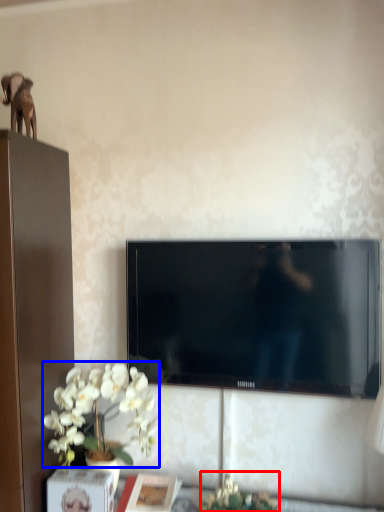
Question: Among these objects, which one is nearest to the camera, plant (highlighted by a red box) or flower (highlighted by a blue box)?

Choices:
 (A) plant
 (B) flower

Answer: (A)